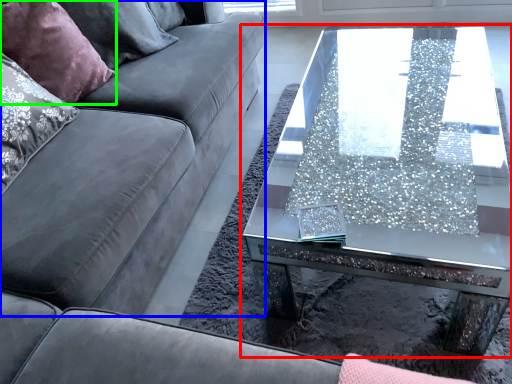
Question: Which object is the closest to the coffee table (highlighted by a red box)? Choose among these: couch (highlighted by a blue box) or pillow (highlighted by a green box).

Choices:
 (A) couch
 (B) pillow

Answer: (A)